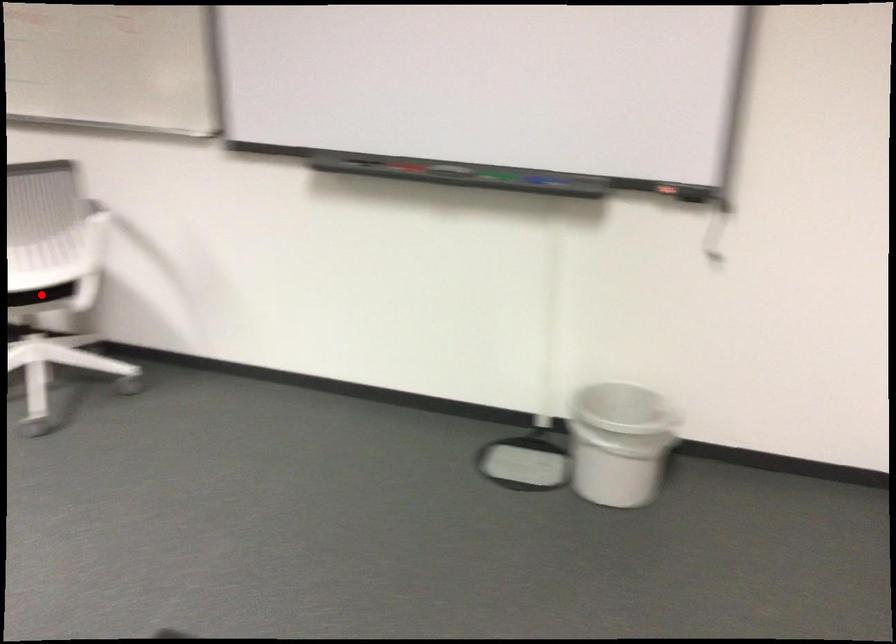
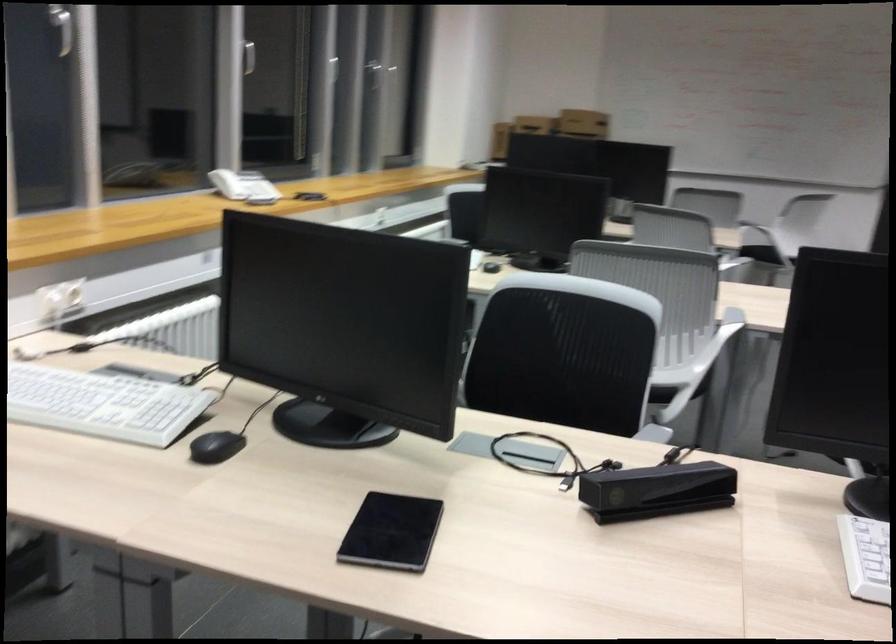
Question: I am providing you with two images of the same scene from different viewpoints. A red point is marked on the first image. At the location where the point appears in image 1, is it still visible in image 2?

Choices:
 (A) Yes
 (B) No

Answer: (B)